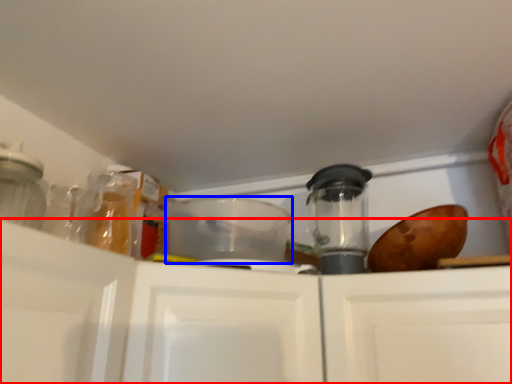
Question: Which of the following is the closest to the observer, cabinetry (highlighted by a red box) or appliance (highlighted by a blue box)?

Choices:
 (A) cabinetry
 (B) appliance

Answer: (A)